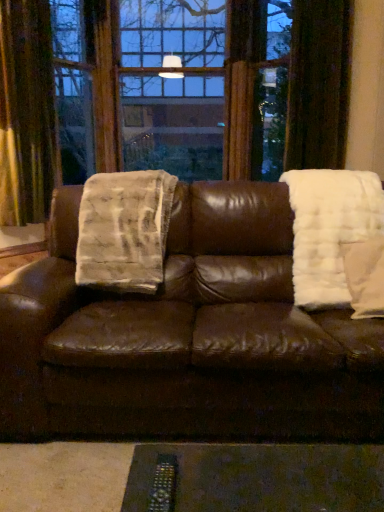
Question: Is brown leather couch at center wider or thinner than white fluffy blanket at right, acting as the second blanket starting from the left?

Choices:
 (A) wide
 (B) thin

Answer: (A)

Question: From the image's perspective, relative to white fluffy blanket at right, the 1th blanket positioned from the right, is brown leather couch at center above or below?

Choices:
 (A) below
 (B) above

Answer: (A)

Question: Which object is positioned closest to the white fluffy blanket at right, the 1th blanket positioned from the right?

Choices:
 (A) white fluffy pillow at right
 (B) white furry blanket at left, positioned as the second blanket in right-to-left order
 (C) brown leather couch at center
 (D) velvet gold curtain at left

Answer: (A)

Question: Based on their relative distances, which object is farther from the white fluffy blanket at right, the 1th blanket positioned from the right?

Choices:
 (A) white furry blanket at left, positioned as the second blanket in right-to-left order
 (B) velvet gold curtain at left
 (C) brown leather couch at center
 (D) white fluffy pillow at right

Answer: (B)